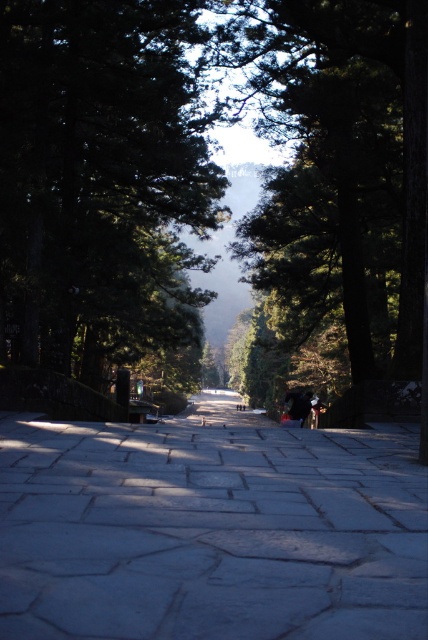
Does point (162, 93) come behind point (288, 0)?

Yes, it is behind point (288, 0).

Which is above, green textured tree at center or green matte tree at center?

green textured tree at center

Locate an element on the screen. The image size is (428, 640). green textured tree at center is located at coordinates (101, 179).

The image size is (428, 640). Identify the location of gray stone pavement at center. (211, 529).

This screenshot has height=640, width=428. I want to click on gray stone pavement at center, so click(211, 529).

Which is in front, point (85, 540) or point (273, 51)?

Point (85, 540) is in front.

Measure the distance between gray stone pavement at center and camera.

gray stone pavement at center and camera are 3.65 meters apart.

Is point (335, 515) closer to viewer compared to point (416, 138)?

That is True.

Locate an element on the screen. gray stone pavement at center is located at coordinates (211, 529).